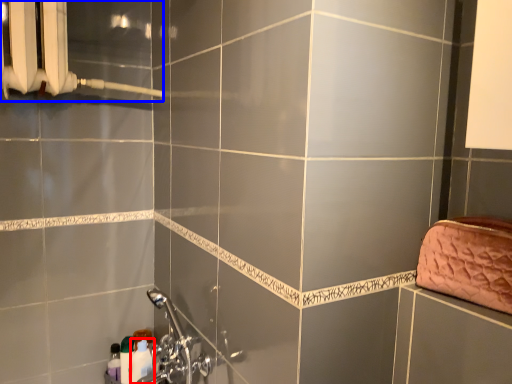
Question: Which of the following is the farthest to the observer, toiletry (highlighted by a red box) or shower (highlighted by a blue box)?

Choices:
 (A) toiletry
 (B) shower

Answer: (A)